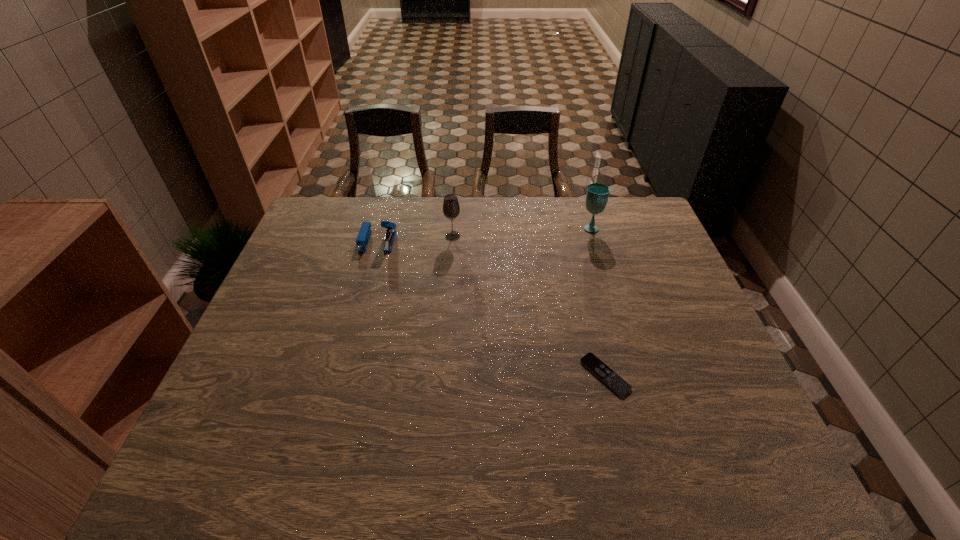
What are the coordinates of `unoccupied area between the left glass drink container and the remote control` in the screenshot? It's located at (529, 306).

Locate an element on the screen. This screenshot has width=960, height=540. vacant point located between the right glass drink container and the stapler is located at coordinates (485, 234).

Where is `free point between the third tallest object and the nearest object`? The width and height of the screenshot is (960, 540). free point between the third tallest object and the nearest object is located at coordinates (492, 308).

You are a GUI agent. You are given a task and a screenshot of the screen. Output one action in this format:
    pyautogui.click(x=<x>, y=<y>)
    Task: Click on the free space between the third object from right to left and the right glass drink container
    The height and width of the screenshot is (540, 960).
    Given the screenshot: What is the action you would take?
    tap(522, 232)

You are a GUI agent. You are given a task and a screenshot of the screen. Output one action in this format:
    pyautogui.click(x=<x>, y=<y>)
    Task: Click on the empty location between the second object from left to right and the third tallest object
    
    Given the screenshot: What is the action you would take?
    pyautogui.click(x=416, y=238)

Image resolution: width=960 pixels, height=540 pixels. In order to click on free area in between the right glass drink container and the leftmost object in this screenshot , I will do `click(485, 234)`.

Where is `object that ranks as the third closest to the right glass drink container`? This screenshot has width=960, height=540. object that ranks as the third closest to the right glass drink container is located at coordinates (364, 234).

The width and height of the screenshot is (960, 540). I want to click on object identified as the closest to the stapler, so click(451, 209).

What are the coordinates of `free point that satisfies the following two spatial constraints: 1. on the back side of the left glass drink container; 2. on the right side of the third tallest object` in the screenshot? It's located at (379, 236).

I want to click on vacant space that satisfies the following two spatial constraints: 1. on the back side of the left glass drink container; 2. on the right side of the right glass drink container, so click(x=453, y=227).